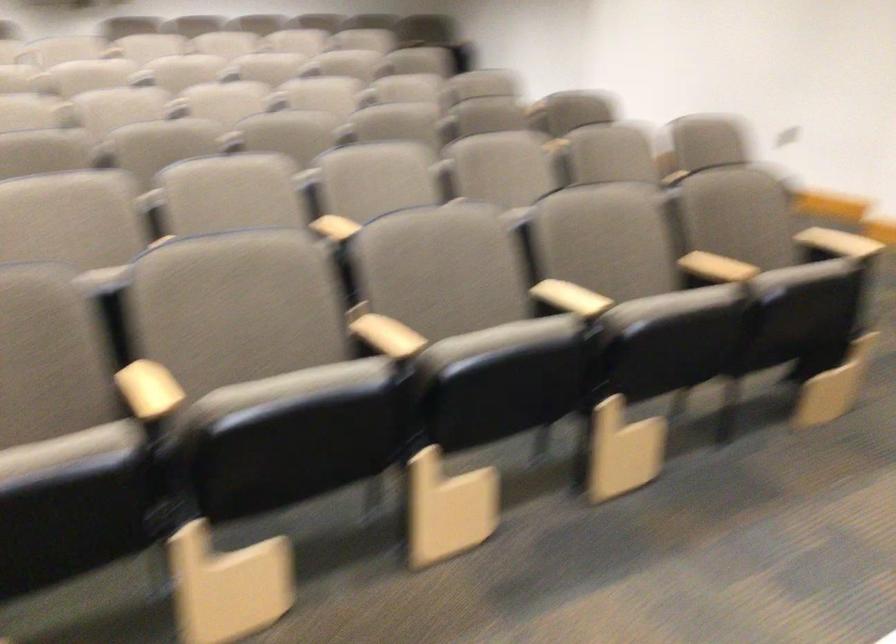
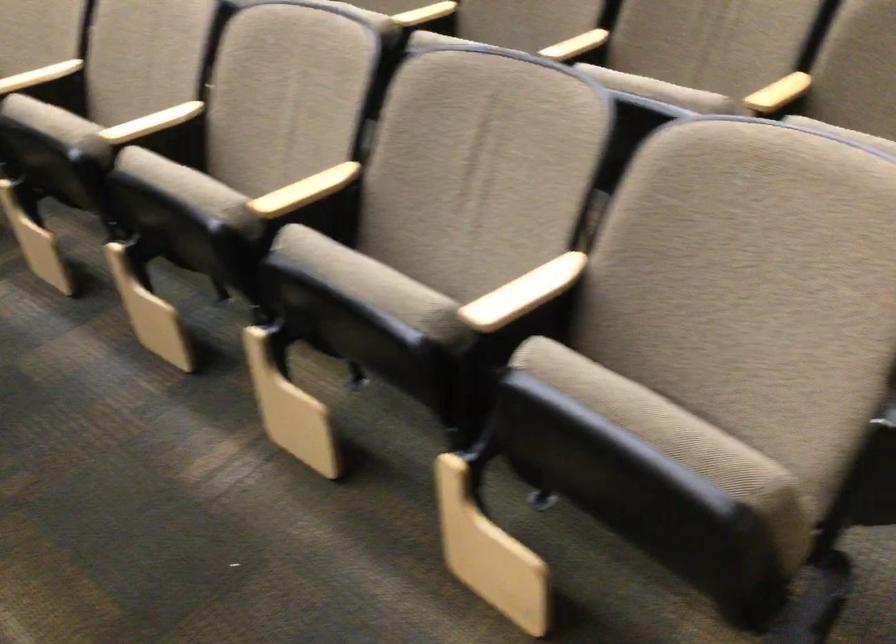
In the second image, find the point that corresponds to the point at 609,171 in the first image.

(305, 191)